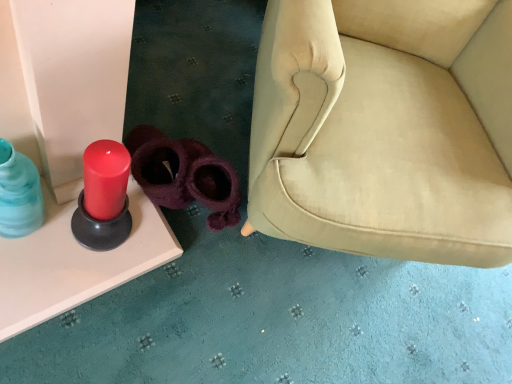
Question: Should I look upward or downward to see translucent blue glass bottle at left?

Choices:
 (A) down
 (B) up

Answer: (B)

Question: From a real-world perspective, is translucent blue glass bottle at left below purple fuzzy slippers at center, the 2th footwear when ordered from right to left?

Choices:
 (A) no
 (B) yes

Answer: (A)

Question: Does translucent blue glass bottle at left have a greater width compared to purple fuzzy slippers at center, positioned as the first footwear in left-to-right order?

Choices:
 (A) yes
 (B) no

Answer: (B)

Question: Is translucent blue glass bottle at left smaller than purple fuzzy slippers at center, positioned as the first footwear in left-to-right order?

Choices:
 (A) yes
 (B) no

Answer: (A)

Question: Is translucent blue glass bottle at left looking in the opposite direction of purple fuzzy slippers at center, the 2th footwear when ordered from right to left?

Choices:
 (A) no
 (B) yes

Answer: (A)

Question: Are translucent blue glass bottle at left and purple fuzzy slippers at center, the 2th footwear when ordered from right to left, located far from each other?

Choices:
 (A) yes
 (B) no

Answer: (B)

Question: Considering the relative sizes of translucent blue glass bottle at left and purple fuzzy slippers at center, positioned as the first footwear in left-to-right order, in the image provided, is translucent blue glass bottle at left thinner than purple fuzzy slippers at center, positioned as the first footwear in left-to-right order,?

Choices:
 (A) yes
 (B) no

Answer: (A)

Question: Is matte red candle at left positioned with its back to purple fuzzy slippers at lower center, the second footwear from the left?

Choices:
 (A) no
 (B) yes

Answer: (A)

Question: From a real-world perspective, is matte red candle at left beneath purple fuzzy slippers at lower center, the second footwear from the left?

Choices:
 (A) yes
 (B) no

Answer: (B)

Question: Does matte red candle at left come behind purple fuzzy slippers at lower center, the first footwear positioned from the right?

Choices:
 (A) no
 (B) yes

Answer: (A)

Question: From the image's perspective, is matte red candle at left below purple fuzzy slippers at lower center, the second footwear from the left?

Choices:
 (A) yes
 (B) no

Answer: (B)

Question: Is purple fuzzy slippers at lower center, the first footwear positioned from the right, a part of matte red candle at left?

Choices:
 (A) no
 (B) yes

Answer: (A)

Question: Considering the relative sizes of matte red candle at left and purple fuzzy slippers at lower center, the first footwear positioned from the right, in the image provided, is matte red candle at left bigger than purple fuzzy slippers at lower center, the first footwear positioned from the right,?

Choices:
 (A) no
 (B) yes

Answer: (B)

Question: Does purple fuzzy slippers at lower center, the first footwear positioned from the right, have a greater height compared to translucent blue glass bottle at left?

Choices:
 (A) no
 (B) yes

Answer: (A)